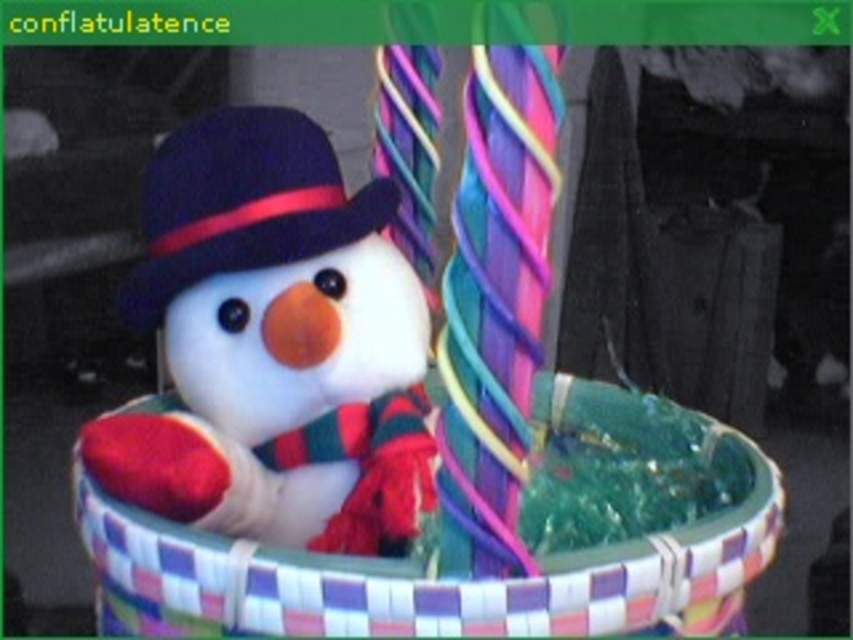
You are a delivery robot with a package that needs to be placed between the white plush snowman at center and the woven fabric basket at center. The package is 10 centimeters long. Will it fit in the space between them?

The distance between the white plush snowman at center and the woven fabric basket at center is 9.66 centimeters. Since the package is 10 centimeters long, it will not fit in the space between them.

You are a delivery person who needs to place the white plush snowman at center into the woven fabric basket at center. Based on their sizes, will the snowman fit inside the basket?

The white plush snowman at center has a smaller size compared to woven fabric basket at center, so the snowman will fit inside the basket.

You are standing in front of the festive snowman scene. You need to place a small gift exactly where the woven fabric basket at center is located. What are the coordinates of the point where you should place the gift?

The coordinates for the woven fabric basket at center are at point (460, 577).